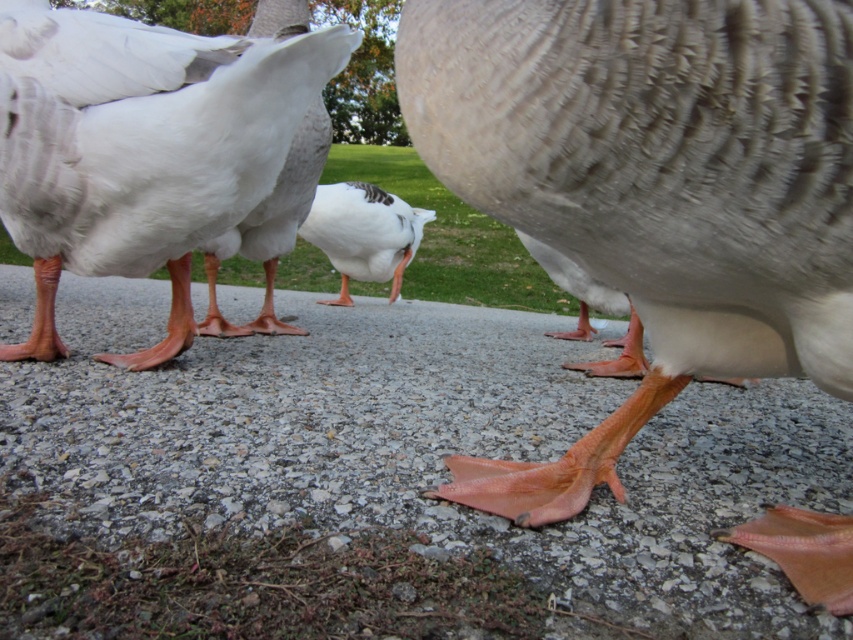
Is orange rubber duck feet at center to the right of white matte duck at center from the viewer's perspective?

In fact, orange rubber duck feet at center is to the left of white matte duck at center.

Is point (775, 419) positioned in front of point (344, 294)?

Yes, point (775, 419) is in front of point (344, 294).

Locate an element on the screen. orange rubber duck feet at center is located at coordinates (425, 448).

Does matte white duck at lower left have a lesser width compared to white matte duck at center?

Incorrect, matte white duck at lower left's width is not less than white matte duck at center's.

Is matte white duck at lower left bigger than white matte duck at center?

No, matte white duck at lower left is not bigger than white matte duck at center.

Does point (126, 120) come closer to viewer compared to point (335, 186)?

That is True.

In order to click on matte white duck at lower left in this screenshot , I will do `click(138, 147)`.

Is point (796, 168) positioned in front of point (4, 141)?

Yes, point (796, 168) is closer to viewer.

Is point (561, 209) behind point (289, 99)?

That is False.

Find the location of `matte gray duck foot at center`. matte gray duck foot at center is located at coordinates (651, 186).